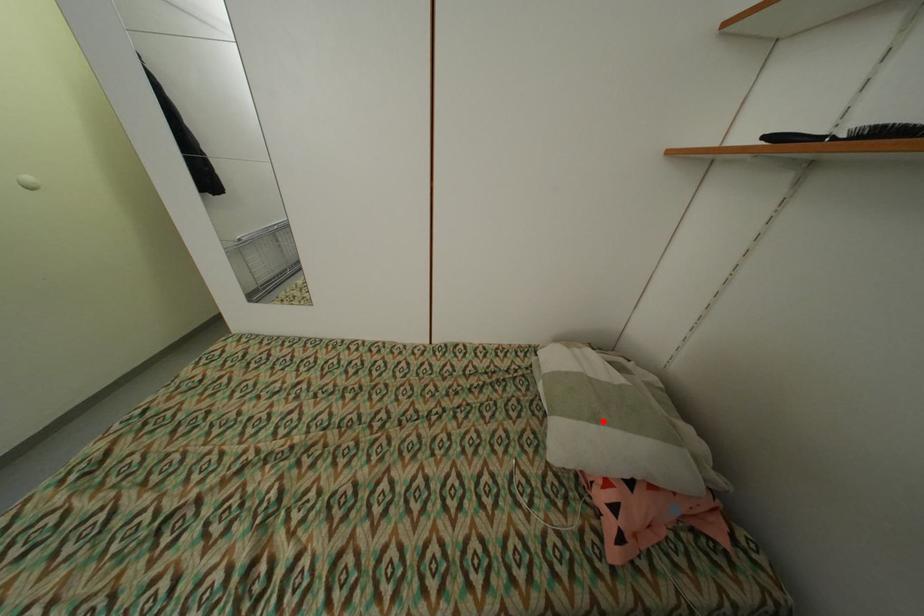
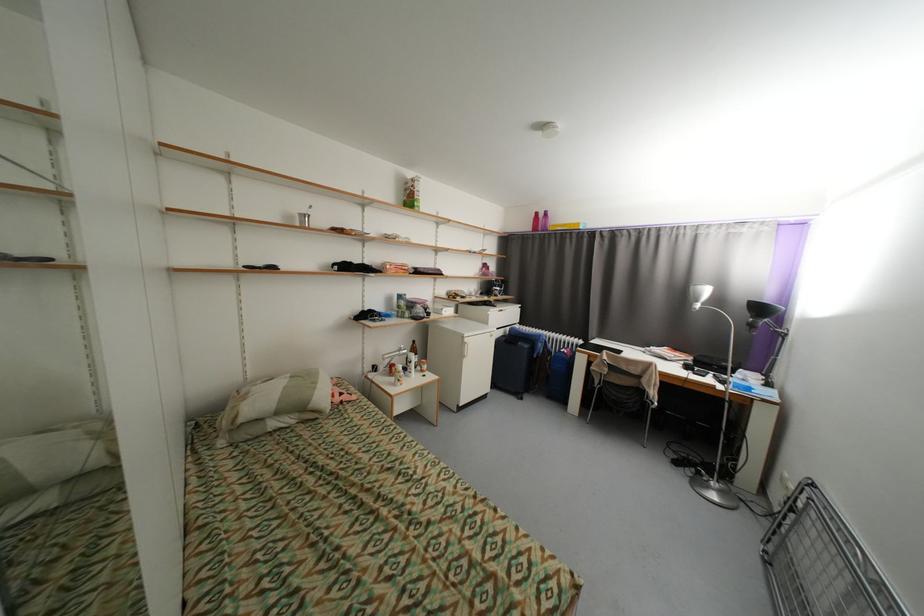
Where in the second image is the point corresponding to the highlighted location from the first image?

(322, 384)